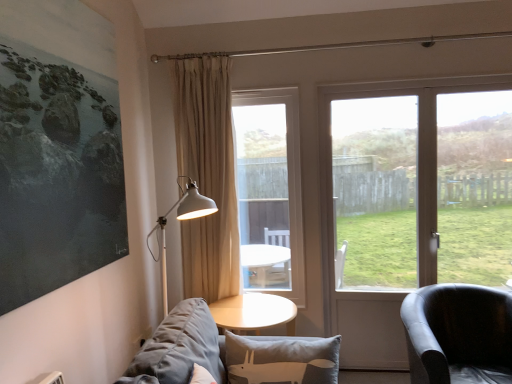
Question: In terms of height, does black leather armchair at right look taller or shorter compared to transparent glass screen door at right?

Choices:
 (A) short
 (B) tall

Answer: (A)

Question: Considering the positions of black leather armchair at right and transparent glass screen door at right in the image, is black leather armchair at right bigger or smaller than transparent glass screen door at right?

Choices:
 (A) big
 (B) small

Answer: (A)

Question: Estimate the real-world distances between objects in this image. Which object is closer to the clear glass window at center, the 1th window in the left-to-right sequence?

Choices:
 (A) black leather armchair at right
 (B) beige fabric curtain at center
 (C) transparent glass screen door at right
 (D) transparent glass door at right, which appears as the first window when viewed from the right
 (E) gray fabric couch at lower left

Answer: (B)

Question: Considering the real-world distances, which object is farthest from the transparent glass screen door at right?

Choices:
 (A) clear glass window at center, the 1th window in the left-to-right sequence
 (B) transparent glass door at right, which appears as the first window when viewed from the right
 (C) gray fabric couch at lower left
 (D) black leather armchair at right
 (E) beige fabric curtain at center

Answer: (A)